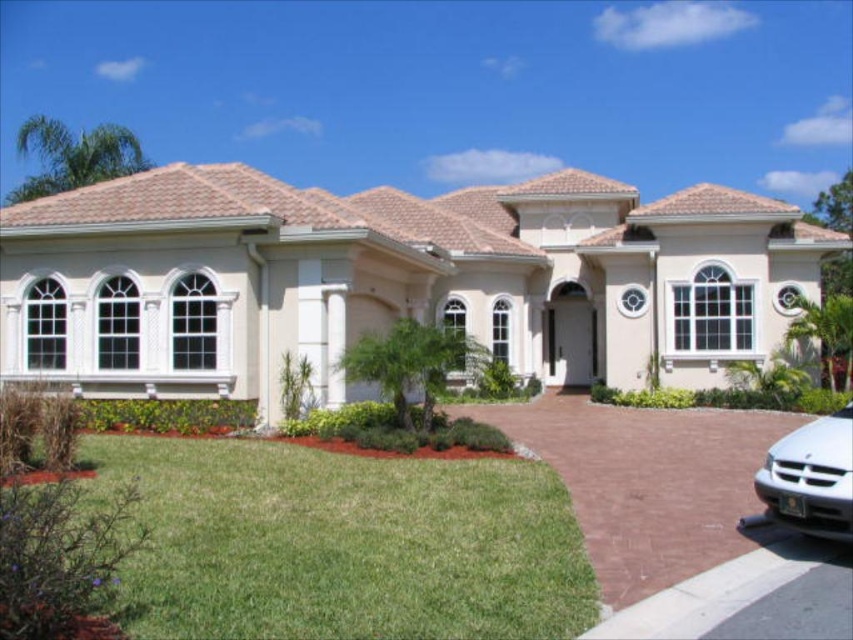
Which is more to the right, green grass at lower left or silver metallic sedan at lower right?

silver metallic sedan at lower right

Who is lower down, green grass at lower left or silver metallic sedan at lower right?

green grass at lower left is below.

The height and width of the screenshot is (640, 853). What do you see at coordinates (341, 544) in the screenshot?
I see `green grass at lower left` at bounding box center [341, 544].

Locate an element on the screen. green grass at lower left is located at coordinates (341, 544).

Between green grass at lower left and brown concrete driveway at lower right, which one is positioned higher?

green grass at lower left is above.

Is green grass at lower left to the right of brown concrete driveway at lower right from the viewer's perspective?

In fact, green grass at lower left is to the left of brown concrete driveway at lower right.

Is point (219, 465) closer to viewer compared to point (630, 486)?

No.

Where is `green grass at lower left`? The height and width of the screenshot is (640, 853). green grass at lower left is located at coordinates (x=341, y=544).

Who is more forward, [527,445] or [821,492]?

Positioned in front is point [821,492].

Does brown concrete driveway at lower right have a greater height compared to silver metallic sedan at lower right?

No.

Does point (662, 444) come in front of point (775, 509)?

No, it is not.

The height and width of the screenshot is (640, 853). I want to click on brown concrete driveway at lower right, so click(x=646, y=481).